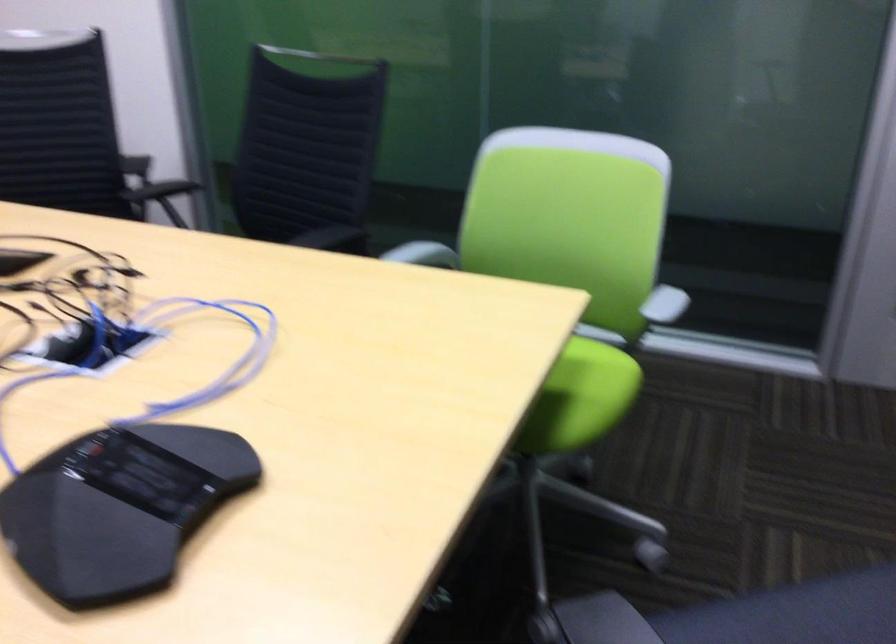
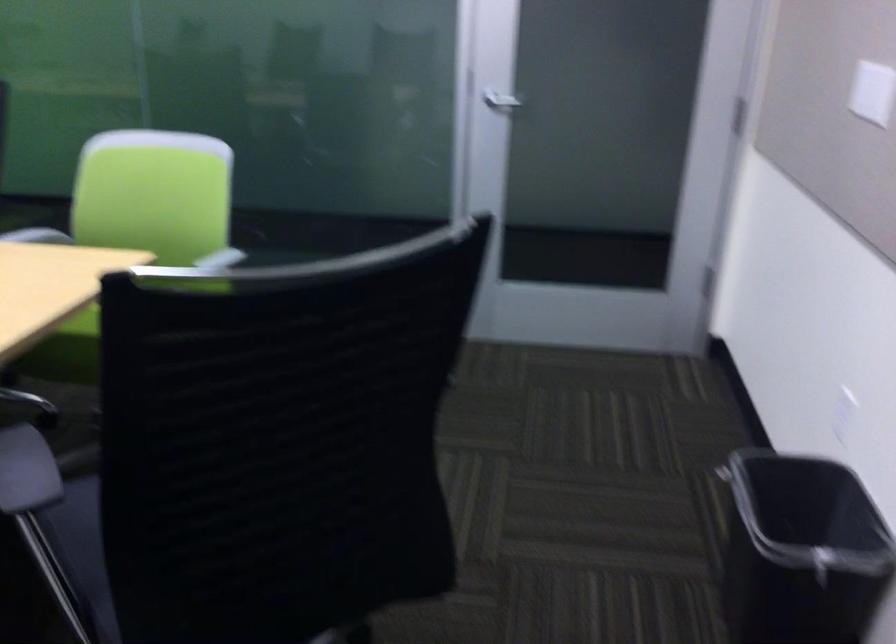
In a continuous first-person perspective shot, in which direction is the camera moving?

The movement direction of the cameraman is right, backward.